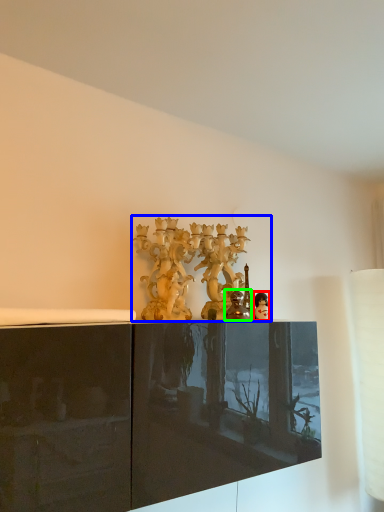
Question: Which object is the closest to the person (highlighted by a red box)? Choose among these: collection (highlighted by a blue box) or figurine (highlighted by a green box).

Choices:
 (A) collection
 (B) figurine

Answer: (B)